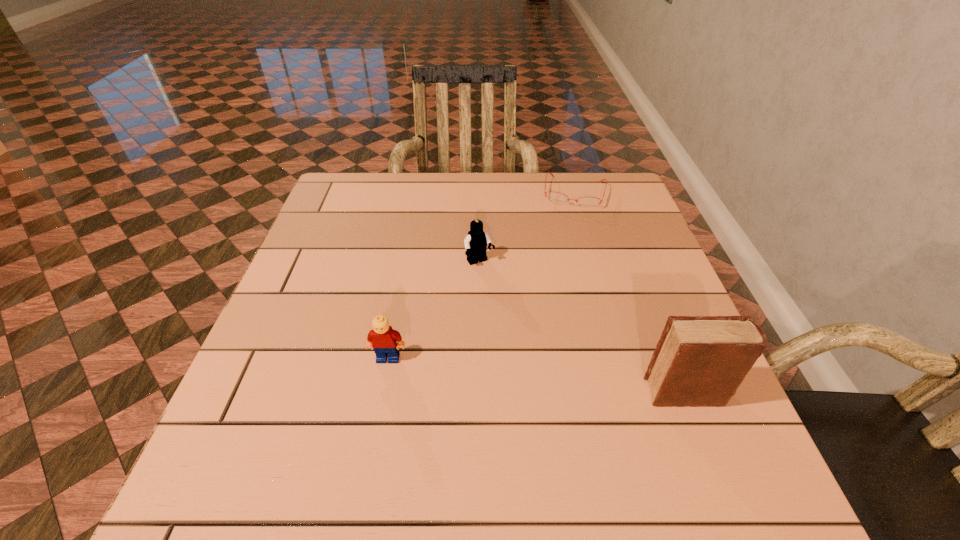
At what (x,y) coordinates should I click in order to perform the action: click on vacant space that is in between the spectacles and the third object from right to left. Please return your answer as a coordinate pair (x, y). Image resolution: width=960 pixels, height=540 pixels. Looking at the image, I should click on (527, 227).

Identify the location of free spot between the right Lego and the tallest object. (583, 327).

Locate an element on the screen. The height and width of the screenshot is (540, 960). free space between the second nearest object and the farther Lego is located at coordinates (434, 310).

At what (x,y) coordinates should I click in order to perform the action: click on free space that is in between the leftmost object and the nearest object. Please return your answer as a coordinate pair (x, y). The image size is (960, 540). Looking at the image, I should click on (538, 375).

Image resolution: width=960 pixels, height=540 pixels. Find the location of `free space between the diary and the shortest object`. free space between the diary and the shortest object is located at coordinates (x=630, y=292).

This screenshot has height=540, width=960. I want to click on vacant area that lies between the shortest object and the nearest object, so (630, 292).

Locate an element on the screen. unoccupied position between the nearest object and the second nearest object is located at coordinates (538, 375).

Locate an element on the screen. free spot between the nearest object and the leftmost object is located at coordinates (538, 375).

Image resolution: width=960 pixels, height=540 pixels. Identify the location of vacant point located between the diary and the shortest object. (630, 292).

You are a GUI agent. You are given a task and a screenshot of the screen. Output one action in this format:
    pyautogui.click(x=<x>, y=<y>)
    Task: Click on the object that stands as the closest to the tallest object
    
    Given the screenshot: What is the action you would take?
    pyautogui.click(x=476, y=241)